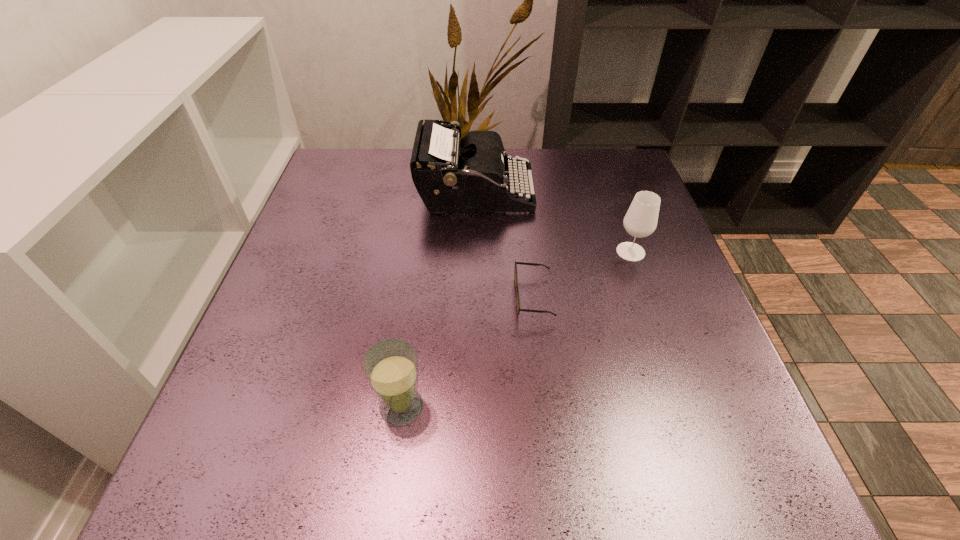
I want to click on typewriter, so click(451, 175).

Find the location of a particular element. This screenshot has width=960, height=540. the farther glass is located at coordinates (641, 219).

Where is `the second farthest object`? the second farthest object is located at coordinates (641, 219).

The width and height of the screenshot is (960, 540). I want to click on the left glass, so click(390, 366).

Where is `the nearest object`? The width and height of the screenshot is (960, 540). the nearest object is located at coordinates (390, 366).

The width and height of the screenshot is (960, 540). In order to click on the shortest object in this screenshot , I will do `click(523, 263)`.

You are a GUI agent. You are given a task and a screenshot of the screen. Output one action in this format:
    pyautogui.click(x=<x>, y=<y>)
    Task: Click on the third farthest object
    The height and width of the screenshot is (540, 960).
    Given the screenshot: What is the action you would take?
    pyautogui.click(x=523, y=263)

Identify the location of vacant space situated on the typing side of the farthest object. (603, 193).

The image size is (960, 540). What are the coordinates of `vacant space situated 0.370m on the back of the second farthest object` in the screenshot? It's located at (597, 156).

Find the location of a particular element. blank space located on the right of the nearer glass is located at coordinates (615, 406).